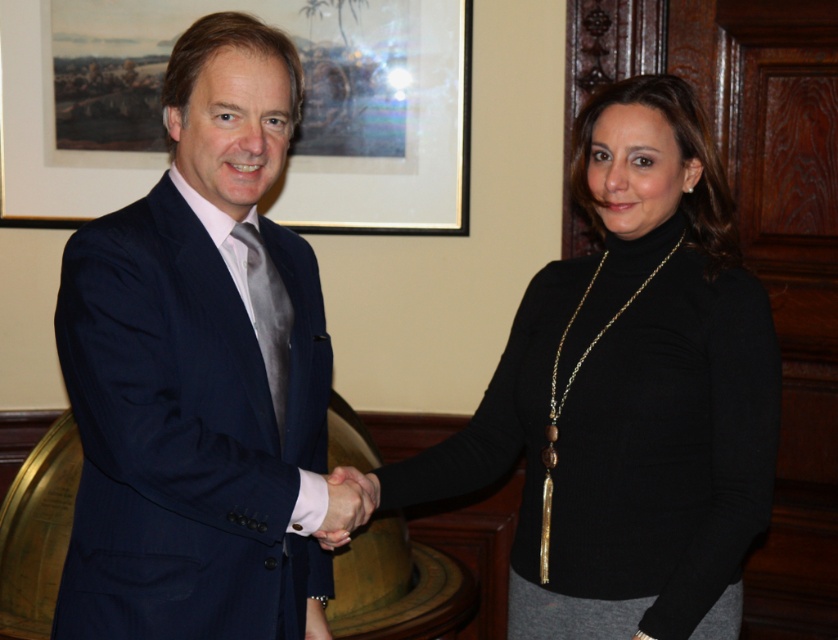
Where is `navy blue suit at center`? navy blue suit at center is located at coordinates (199, 372).

Does navy blue suit at center appear over white matte hand at center?

Indeed, navy blue suit at center is positioned over white matte hand at center.

The width and height of the screenshot is (838, 640). What do you see at coordinates (199, 372) in the screenshot?
I see `navy blue suit at center` at bounding box center [199, 372].

Where is `navy blue suit at center`? navy blue suit at center is located at coordinates (199, 372).

Can you confirm if black matte turtleneck at center is positioned below wooden picture frame at upper center?

Yes, black matte turtleneck at center is below wooden picture frame at upper center.

Does black matte turtleneck at center have a lesser width compared to wooden picture frame at upper center?

Yes.

Is point (683, 188) positioned in front of point (273, 24)?

Yes.

Identify the location of black matte turtleneck at center. (629, 394).

Is wooden picture frame at upper center thinner than white matte hand at center?

In fact, wooden picture frame at upper center might be wider than white matte hand at center.

Who is positioned more to the right, wooden picture frame at upper center or white matte hand at center?

From the viewer's perspective, white matte hand at center appears more on the right side.

Is point (335, 109) in front of point (339, 467)?

No, it is behind (339, 467).

Image resolution: width=838 pixels, height=640 pixels. What are the coordinates of `wooden picture frame at upper center` in the screenshot? It's located at (295, 134).